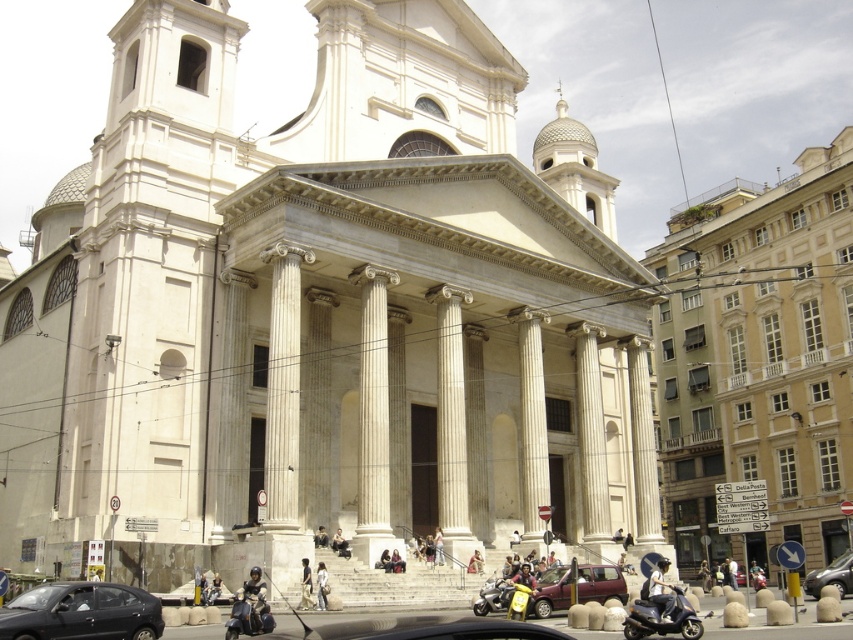
Question: Considering the relative positions of light blue denim jeans at lower right and light beige stone column at center in the image provided, where is light blue denim jeans at lower right located with respect to light beige stone column at center?

Choices:
 (A) right
 (B) left

Answer: (A)

Question: Where is metallic silver car at center located in relation to light beige fabric pants at lower center in the image?

Choices:
 (A) above
 (B) below

Answer: (B)

Question: Which point is closer to the camera?

Choices:
 (A) (444, 563)
 (B) (311, 598)

Answer: (B)

Question: In this image, where is shiny metallic scooter at lower center located relative to white cotton shirt at center?

Choices:
 (A) below
 (B) above

Answer: (A)

Question: Which point is farther to the camera?

Choices:
 (A) (252, 595)
 (B) (666, 618)
 (C) (531, 595)
 (D) (843, 564)

Answer: (D)

Question: Which point is closer to the camera?

Choices:
 (A) (811, 589)
 (B) (581, 568)

Answer: (B)